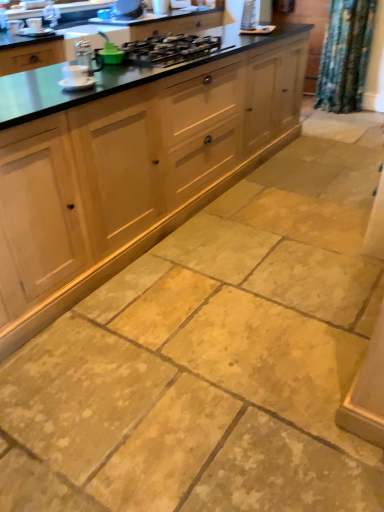
The image size is (384, 512). Identify the location of vacant location behind green plastic brush at upper center, the 4th appliance when ordered from left to right. (127, 58).